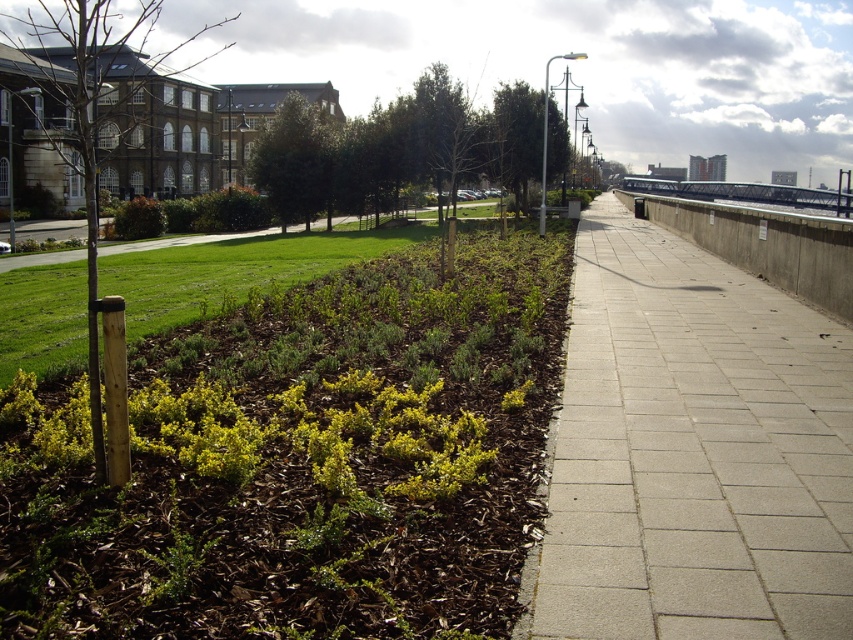
Question: Can you confirm if green mulch at lower left is wider than gray concrete sidewalk at center?

Choices:
 (A) no
 (B) yes

Answer: (A)

Question: Can you confirm if green mulch at lower left is thinner than gray concrete sidewalk at center?

Choices:
 (A) yes
 (B) no

Answer: (A)

Question: Which object is farther from the camera taking this photo?

Choices:
 (A) gray concrete sidewalk at center
 (B) green mulch at lower left

Answer: (A)

Question: Is green mulch at lower left positioned in front of gray concrete sidewalk at center?

Choices:
 (A) yes
 (B) no

Answer: (A)